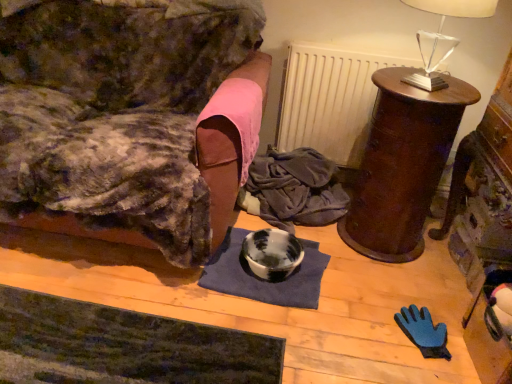
Image resolution: width=512 pixels, height=384 pixels. In order to click on vacant region under clear glass table lamp at upper right (from a real-world perspective) in this screenshot , I will do `click(417, 76)`.